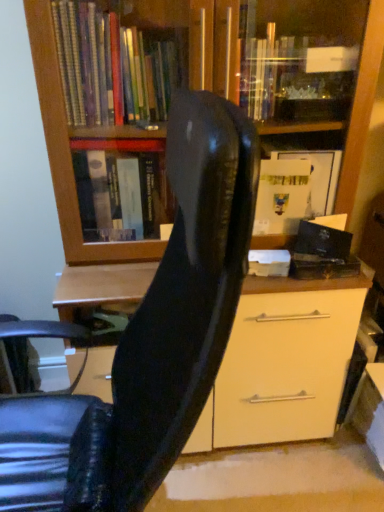
Question: Are black matte book at right and matte wood bookcase at upper center beside each other?

Choices:
 (A) yes
 (B) no

Answer: (B)

Question: From a real-world perspective, is black matte book at right physically below matte wood bookcase at upper center?

Choices:
 (A) yes
 (B) no

Answer: (B)

Question: Is black matte book at right located outside matte wood bookcase at upper center?

Choices:
 (A) no
 (B) yes

Answer: (A)

Question: Can you confirm if black matte book at right is thinner than matte wood bookcase at upper center?

Choices:
 (A) yes
 (B) no

Answer: (A)

Question: Does black matte book at right come behind matte wood bookcase at upper center?

Choices:
 (A) yes
 (B) no

Answer: (A)

Question: Is black matte book at right to the left or to the right of matte wood bookcase at upper center in the image?

Choices:
 (A) right
 (B) left

Answer: (A)

Question: In the image, is black matte book at right positioned in front of or behind matte wood bookcase at upper center?

Choices:
 (A) front
 (B) behind

Answer: (B)

Question: Based on their sizes in the image, would you say black matte book at right is bigger or smaller than matte wood bookcase at upper center?

Choices:
 (A) small
 (B) big

Answer: (A)

Question: From a real-world perspective, relative to matte wood bookcase at upper center, is black matte book at right vertically above or below?

Choices:
 (A) below
 (B) above

Answer: (B)

Question: Choose the correct answer: Is black matte book at right inside glossy black chair at center or outside it?

Choices:
 (A) inside
 (B) outside

Answer: (B)

Question: In the image, is black matte book at right positioned in front of or behind glossy black chair at center?

Choices:
 (A) behind
 (B) front

Answer: (A)

Question: Looking at their shapes, would you say black matte book at right is wider or thinner than glossy black chair at center?

Choices:
 (A) thin
 (B) wide

Answer: (A)

Question: Based on their positions, is black matte book at right located to the left or right of glossy black chair at center?

Choices:
 (A) left
 (B) right

Answer: (B)

Question: From the image's perspective, is matte wood bookcase at upper center located above or below glossy black chair at center?

Choices:
 (A) above
 (B) below

Answer: (A)

Question: From a real-world perspective, is matte wood bookcase at upper center physically located above or below glossy black chair at center?

Choices:
 (A) above
 (B) below

Answer: (A)